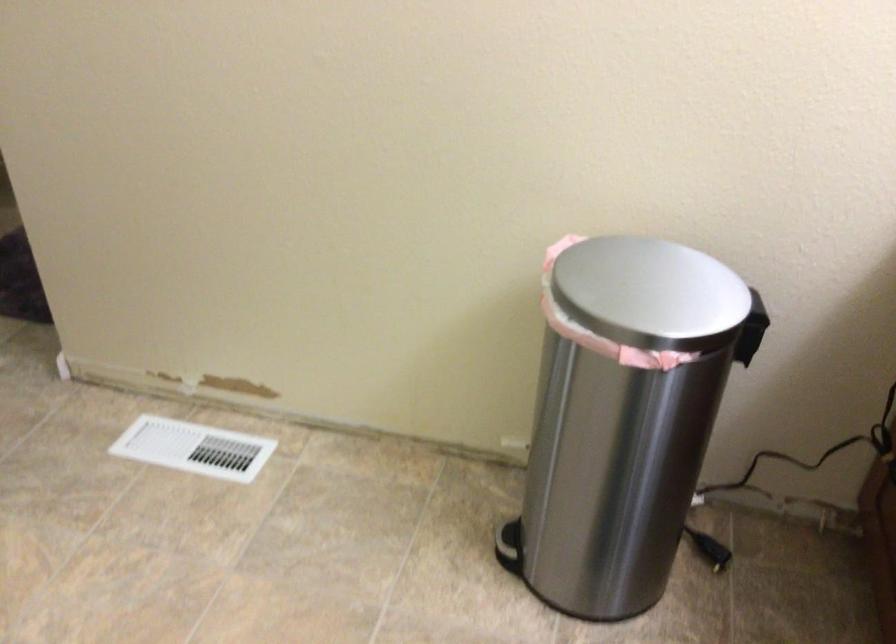
At what (x,y) coordinates should I click in order to perform the action: click on pink trash bag. Please return your answer as a coordinate pair (x, y). The height and width of the screenshot is (644, 896). Looking at the image, I should click on (558, 247).